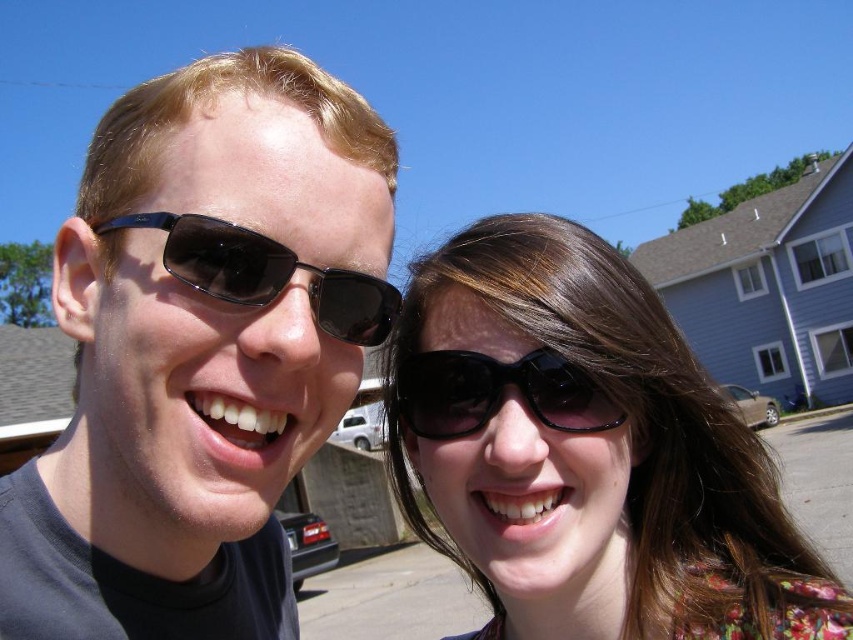
Question: Which object is the farthest from the matte black sunglasses at left?

Choices:
 (A) black plastic sunglasses at left
 (B) black shiny sunglasses at center

Answer: (B)

Question: Which point is closer to the camera?

Choices:
 (A) black plastic sunglasses at left
 (B) black shiny sunglasses at center

Answer: (A)

Question: Estimate the real-world distances between objects in this image. Which object is farther from the black shiny sunglasses at center?

Choices:
 (A) black plastic sunglasses at left
 (B) matte black sunglasses at left

Answer: (B)

Question: From the image, what is the correct spatial relationship of matte black sunglasses at left in relation to black plastic sunglasses at left?

Choices:
 (A) below
 (B) above

Answer: (A)

Question: Can you confirm if black plastic sunglasses at left is thinner than black shiny sunglasses at center?

Choices:
 (A) no
 (B) yes

Answer: (A)

Question: Where is black plastic sunglasses at left located in relation to black shiny sunglasses at center in the image?

Choices:
 (A) right
 (B) left

Answer: (B)